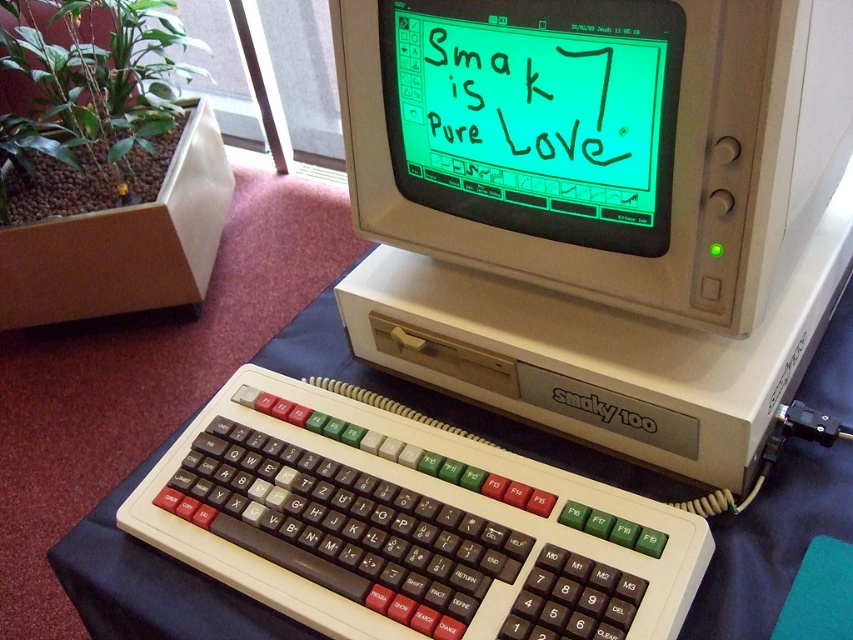
Question: Which object is the farthest from the green matte monitor at center?

Choices:
 (A) beige plastic smaky 100 at center
 (B) brown plastic keyboard at center
 (C) black plastic smaky 100 at center
 (D) green leafy plant at left

Answer: (D)

Question: Can you confirm if green leafy plant at left is positioned to the right of black plastic smaky 100 at center?

Choices:
 (A) no
 (B) yes

Answer: (A)

Question: Does green matte monitor at center appear on the right side of black plastic smaky 100 at center?

Choices:
 (A) yes
 (B) no

Answer: (B)

Question: Which point is farther to the camera?

Choices:
 (A) beige plastic smaky 100 at center
 (B) black plastic smaky 100 at center
 (C) green leafy plant at left

Answer: (C)

Question: Is the position of brown plastic keyboard at center more distant than that of green leafy plant at left?

Choices:
 (A) no
 (B) yes

Answer: (A)

Question: Which point is closer to the camera?

Choices:
 (A) (90, 81)
 (B) (248, 504)

Answer: (B)